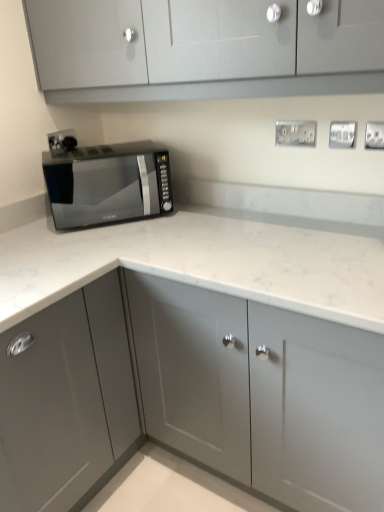
What do you see at coordinates (374, 135) in the screenshot? I see `satin silver outlet at upper right, the 1th electric outlet positioned from the front` at bounding box center [374, 135].

What do you see at coordinates (62, 140) in the screenshot? I see `black plastic socket at upper left, which is counted as the 1th electric outlet, starting from the back` at bounding box center [62, 140].

Describe the element at coordinates (342, 134) in the screenshot. I see `silver metallic electric outlet at upper right, acting as the 2th electric outlet starting from the front` at that location.

In the scene shown: What is the approximate height of matte gray cabinet at upper center, the third cabinetry from the bottom?

The height of matte gray cabinet at upper center, the third cabinetry from the bottom, is 40.62 centimeters.

Where is `satin silver electrical outlet at upper center, which is the third electric outlet in right-to-left order`? Image resolution: width=384 pixels, height=512 pixels. satin silver electrical outlet at upper center, which is the third electric outlet in right-to-left order is located at coordinates (295, 133).

Where is `black glass microwave at left`? The width and height of the screenshot is (384, 512). black glass microwave at left is located at coordinates (107, 184).

Which object is closer to the camera, satin silver electrical outlet at upper center, the 3th electric outlet from the front, or black plastic socket at upper left, the 1th electric outlet positioned from the left?

satin silver electrical outlet at upper center, the 3th electric outlet from the front.

From the image's perspective, does satin silver electrical outlet at upper center, which is the third electric outlet in right-to-left order, appear higher than black plastic socket at upper left, placed as the 4th electric outlet when sorted from right to left?

No, from the image's perspective, satin silver electrical outlet at upper center, which is the third electric outlet in right-to-left order, is not on top of black plastic socket at upper left, placed as the 4th electric outlet when sorted from right to left.

Which of these two, satin silver electrical outlet at upper center, which is counted as the 2th electric outlet, starting from the left, or black plastic socket at upper left, placed as the 4th electric outlet when sorted from right to left, is thinner?

black plastic socket at upper left, placed as the 4th electric outlet when sorted from right to left, is thinner.

In the scene shown: Considering the relative sizes of satin silver electrical outlet at upper center, the second electric outlet viewed from the back, and black plastic socket at upper left, which is counted as the 1th electric outlet, starting from the back, in the image provided, is satin silver electrical outlet at upper center, the second electric outlet viewed from the back, shorter than black plastic socket at upper left, which is counted as the 1th electric outlet, starting from the back,?

In fact, satin silver electrical outlet at upper center, the second electric outlet viewed from the back, may be taller than black plastic socket at upper left, which is counted as the 1th electric outlet, starting from the back.

From the image's perspective, is black glass microwave at left located above black plastic socket at upper left, which is counted as the 1th electric outlet, starting from the back?

No, from the image's perspective, black glass microwave at left is not on top of black plastic socket at upper left, which is counted as the 1th electric outlet, starting from the back.

Does black glass microwave at left have a smaller size compared to black plastic socket at upper left, which is counted as the 1th electric outlet, starting from the back?

Actually, black glass microwave at left might be larger than black plastic socket at upper left, which is counted as the 1th electric outlet, starting from the back.

Is black plastic socket at upper left, the 1th electric outlet positioned from the left, surrounded by black glass microwave at left?

No, black plastic socket at upper left, the 1th electric outlet positioned from the left, is located outside of black glass microwave at left.

Which of these two, black glass microwave at left or black plastic socket at upper left, placed as the 4th electric outlet when sorted from right to left, is wider?

With larger width is black glass microwave at left.

Are matte gray cabinet at center, the second cabinetry when ordered from top to bottom, and matte gray cabinet at upper center, the third cabinetry from the bottom, far apart?

No, matte gray cabinet at center, the second cabinetry when ordered from top to bottom, is not far from matte gray cabinet at upper center, the third cabinetry from the bottom.

Between matte gray cabinet at center, placed as the 2th cabinetry when sorted from bottom to top, and matte gray cabinet at upper center, positioned as the 1th cabinetry in top-to-bottom order, which one has less height?

matte gray cabinet at upper center, positioned as the 1th cabinetry in top-to-bottom order, is shorter.

From the image's perspective, who appears lower, matte gray cabinet at center, the second cabinetry when ordered from top to bottom, or matte gray cabinet at upper center, positioned as the 1th cabinetry in top-to-bottom order?

matte gray cabinet at center, the second cabinetry when ordered from top to bottom.

Which of these two, matte gray cabinet at center, the second cabinetry when ordered from top to bottom, or matte gray cabinet at upper center, the third cabinetry from the bottom, is wider?

matte gray cabinet at center, the second cabinetry when ordered from top to bottom, is wider.

Would you say matte gray cabinet at lower left, the first cabinetry ordered from the bottom, is outside satin silver outlet at upper right, the 4th electric outlet from the left?

matte gray cabinet at lower left, the first cabinetry ordered from the bottom, lies outside satin silver outlet at upper right, the 4th electric outlet from the left,'s area.

Which of these two, matte gray cabinet at lower left, placed as the third cabinetry when sorted from top to bottom, or satin silver outlet at upper right, the 1th electric outlet from the right, is smaller?

Smaller between the two is satin silver outlet at upper right, the 1th electric outlet from the right.

Which object is closer to the camera, matte gray cabinet at lower left, the first cabinetry ordered from the bottom, or satin silver outlet at upper right, the 1th electric outlet from the right?

matte gray cabinet at lower left, the first cabinetry ordered from the bottom.

Between matte gray cabinet at lower left, the first cabinetry ordered from the bottom, and satin silver outlet at upper right, which ranks as the fourth electric outlet in back-to-front order, which one appears on the right side from the viewer's perspective?

From the viewer's perspective, satin silver outlet at upper right, which ranks as the fourth electric outlet in back-to-front order, appears more on the right side.

Which is more to the left, satin silver electrical outlet at upper center, which is counted as the 2th electric outlet, starting from the left, or black glass microwave at left?

black glass microwave at left.

Is satin silver electrical outlet at upper center, the second electric outlet viewed from the back, spatially inside black glass microwave at left, or outside of it?

The correct answer is: outside.

From a real-world perspective, does satin silver electrical outlet at upper center, which is counted as the 2th electric outlet, starting from the left, sit lower than black glass microwave at left?

Actually, satin silver electrical outlet at upper center, which is counted as the 2th electric outlet, starting from the left, is physically above black glass microwave at left in the real world.

How different are the orientations of satin silver electrical outlet at upper center, the second electric outlet viewed from the back, and black glass microwave at left in degrees?

There is a 52.8-degree angle between the facing directions of satin silver electrical outlet at upper center, the second electric outlet viewed from the back, and black glass microwave at left.

Considering the relative sizes of matte gray cabinet at center, placed as the 2th cabinetry when sorted from bottom to top, and satin silver electrical outlet at upper center, which is the third electric outlet in right-to-left order, in the image provided, is matte gray cabinet at center, placed as the 2th cabinetry when sorted from bottom to top, wider than satin silver electrical outlet at upper center, which is the third electric outlet in right-to-left order,?

Yes.

Is matte gray cabinet at center, placed as the 2th cabinetry when sorted from bottom to top, far away from satin silver electrical outlet at upper center, the second electric outlet viewed from the back?

They are positioned close to each other.

From a real-world perspective, which cabinetry is the 2nd one underneath the satin silver electrical outlet at upper center, which is counted as the 2th electric outlet, starting from the left? Please provide its 2D coordinates.

[(190, 394)]

Is silver metallic electric outlet at upper right, which is the 3th electric outlet from left to right, completely or partially inside matte gray cabinet at center, the second cabinetry when ordered from top to bottom?

That's incorrect, silver metallic electric outlet at upper right, which is the 3th electric outlet from left to right, is not inside matte gray cabinet at center, the second cabinetry when ordered from top to bottom.

From the image's perspective, is matte gray cabinet at center, the second cabinetry when ordered from top to bottom, above silver metallic electric outlet at upper right, which appears as the 3th electric outlet when viewed from the back?

No, from the image's perspective, matte gray cabinet at center, the second cabinetry when ordered from top to bottom, is not over silver metallic electric outlet at upper right, which appears as the 3th electric outlet when viewed from the back.

Does matte gray cabinet at center, placed as the 2th cabinetry when sorted from bottom to top, have a greater width compared to silver metallic electric outlet at upper right, which is the 2th electric outlet in right-to-left order?

Yes, matte gray cabinet at center, placed as the 2th cabinetry when sorted from bottom to top, is wider than silver metallic electric outlet at upper right, which is the 2th electric outlet in right-to-left order.

Can you confirm if matte gray cabinet at center, placed as the 2th cabinetry when sorted from bottom to top, is positioned to the left of silver metallic electric outlet at upper right, which appears as the 3th electric outlet when viewed from the back?

Yes.

The width and height of the screenshot is (384, 512). In order to click on electric outlet lying behind the satin silver electrical outlet at upper center, which is counted as the 2th electric outlet, starting from the left in this screenshot , I will do `click(62, 140)`.

Identify the location of microwave oven in front of the black plastic socket at upper left, which is counted as the 1th electric outlet, starting from the back. (107, 184).

Based on the photo, estimate the real-world distances between objects in this image. Which object is closer to matte gray cabinet at lower left, placed as the third cabinetry when sorted from top to bottom, satin silver electrical outlet at upper center, which is counted as the 2th electric outlet, starting from the left, or black glass microwave at left?

Among the two, black glass microwave at left is located nearer to matte gray cabinet at lower left, placed as the third cabinetry when sorted from top to bottom.

Considering their positions, is satin silver outlet at upper right, the 1th electric outlet positioned from the front, positioned closer to matte gray cabinet at center, placed as the 2th cabinetry when sorted from bottom to top, than black glass microwave at left?

black glass microwave at left.

From the image, which object appears to be nearer to matte gray cabinet at center, placed as the 2th cabinetry when sorted from bottom to top, satin silver electrical outlet at upper center, the second electric outlet viewed from the back, or black glass microwave at left?

black glass microwave at left.

Estimate the real-world distances between objects in this image. Which object is closer to black plastic socket at upper left, which ranks as the fourth electric outlet in front-to-back order, silver metallic electric outlet at upper right, which is the 3th electric outlet from left to right, or matte gray cabinet at lower left, the first cabinetry ordered from the bottom?

matte gray cabinet at lower left, the first cabinetry ordered from the bottom, is positioned closer to the anchor black plastic socket at upper left, which ranks as the fourth electric outlet in front-to-back order.

When comparing their distances from matte gray cabinet at lower left, placed as the third cabinetry when sorted from top to bottom, does satin silver electrical outlet at upper center, which is the third electric outlet in right-to-left order, or satin silver outlet at upper right, the 1th electric outlet from the right, seem closer?

Answer: satin silver electrical outlet at upper center, which is the third electric outlet in right-to-left order, is closer to matte gray cabinet at lower left, placed as the third cabinetry when sorted from top to bottom.

Estimate the real-world distances between objects in this image. Which object is further from silver metallic electric outlet at upper right, which is the 3th electric outlet from left to right, satin silver outlet at upper right, the 1th electric outlet positioned from the front, or satin silver electrical outlet at upper center, which is counted as the 2th electric outlet, starting from the left?

satin silver electrical outlet at upper center, which is counted as the 2th electric outlet, starting from the left, lies further to silver metallic electric outlet at upper right, which is the 3th electric outlet from left to right, than the other object.

Looking at the image, which one is located closer to silver metallic electric outlet at upper right, which is the 2th electric outlet in right-to-left order, matte gray cabinet at lower left, placed as the third cabinetry when sorted from top to bottom, or black glass microwave at left?

Among the two, black glass microwave at left is located nearer to silver metallic electric outlet at upper right, which is the 2th electric outlet in right-to-left order.

Based on their spatial positions, is matte gray cabinet at upper center, positioned as the 1th cabinetry in top-to-bottom order, or silver metallic electric outlet at upper right, which is the 3th electric outlet from left to right, closer to matte gray cabinet at center, placed as the 2th cabinetry when sorted from bottom to top?

The object closer to matte gray cabinet at center, placed as the 2th cabinetry when sorted from bottom to top, is matte gray cabinet at upper center, positioned as the 1th cabinetry in top-to-bottom order.

Where is `cabinetry between black glass microwave at left and matte gray cabinet at lower left, placed as the third cabinetry when sorted from top to bottom, vertically`? Image resolution: width=384 pixels, height=512 pixels. cabinetry between black glass microwave at left and matte gray cabinet at lower left, placed as the third cabinetry when sorted from top to bottom, vertically is located at coordinates (190, 394).

At what (x,y) coordinates should I click in order to perform the action: click on microwave oven between matte gray cabinet at lower left, the first cabinetry ordered from the bottom, and satin silver outlet at upper right, the 1th electric outlet positioned from the front, from left to right. Please return your answer as a coordinate pair (x, y). Looking at the image, I should click on (107, 184).

Image resolution: width=384 pixels, height=512 pixels. I want to click on cabinetry between matte gray cabinet at upper center, the third cabinetry from the bottom, and matte gray cabinet at lower left, the first cabinetry ordered from the bottom, in the up-down direction, so click(x=190, y=394).

Locate an element on the screen. This screenshot has width=384, height=512. microwave oven between matte gray cabinet at upper center, positioned as the 1th cabinetry in top-to-bottom order, and black plastic socket at upper left, which ranks as the fourth electric outlet in front-to-back order, from front to back is located at coordinates (107, 184).